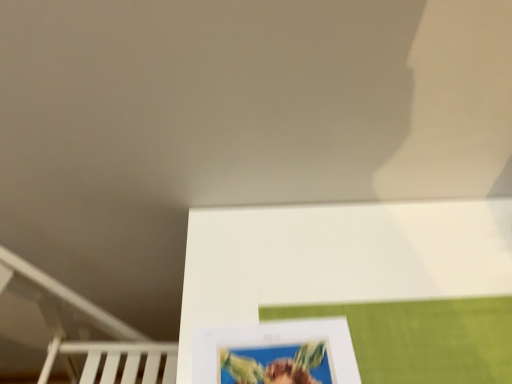
Question: Can you confirm if white matte bunk bed at lower left is smaller than white matte picture frame at lower center?

Choices:
 (A) no
 (B) yes

Answer: (A)

Question: Does white matte bunk bed at lower left come behind white matte picture frame at lower center?

Choices:
 (A) no
 (B) yes

Answer: (B)

Question: Considering the relative positions of white matte bunk bed at lower left and white matte picture frame at lower center in the image provided, is white matte bunk bed at lower left to the right of white matte picture frame at lower center from the viewer's perspective?

Choices:
 (A) yes
 (B) no

Answer: (B)

Question: Is white matte bunk bed at lower left completely or partially outside of white matte picture frame at lower center?

Choices:
 (A) no
 (B) yes

Answer: (B)

Question: Considering the relative sizes of white matte bunk bed at lower left and white matte picture frame at lower center in the image provided, is white matte bunk bed at lower left thinner than white matte picture frame at lower center?

Choices:
 (A) no
 (B) yes

Answer: (A)

Question: From the image's perspective, is white matte bunk bed at lower left on white matte picture frame at lower center?

Choices:
 (A) no
 (B) yes

Answer: (A)

Question: From a real-world perspective, is white matte picture frame at lower center physically below white matte bunk bed at lower left?

Choices:
 (A) no
 (B) yes

Answer: (A)

Question: Is white matte picture frame at lower center outside white matte bunk bed at lower left?

Choices:
 (A) yes
 (B) no

Answer: (A)

Question: Does white matte picture frame at lower center have a lesser width compared to white matte bunk bed at lower left?

Choices:
 (A) no
 (B) yes

Answer: (B)

Question: Considering the relative sizes of white matte picture frame at lower center and white matte bunk bed at lower left in the image provided, is white matte picture frame at lower center shorter than white matte bunk bed at lower left?

Choices:
 (A) no
 (B) yes

Answer: (B)

Question: Is the position of white matte picture frame at lower center more distant than that of white matte bunk bed at lower left?

Choices:
 (A) yes
 (B) no

Answer: (B)

Question: Is white matte picture frame at lower center smaller than white matte bunk bed at lower left?

Choices:
 (A) no
 (B) yes

Answer: (B)

Question: Relative to white matte bunk bed at lower left, is white matte picture frame at lower center in front or behind?

Choices:
 (A) behind
 (B) front

Answer: (B)